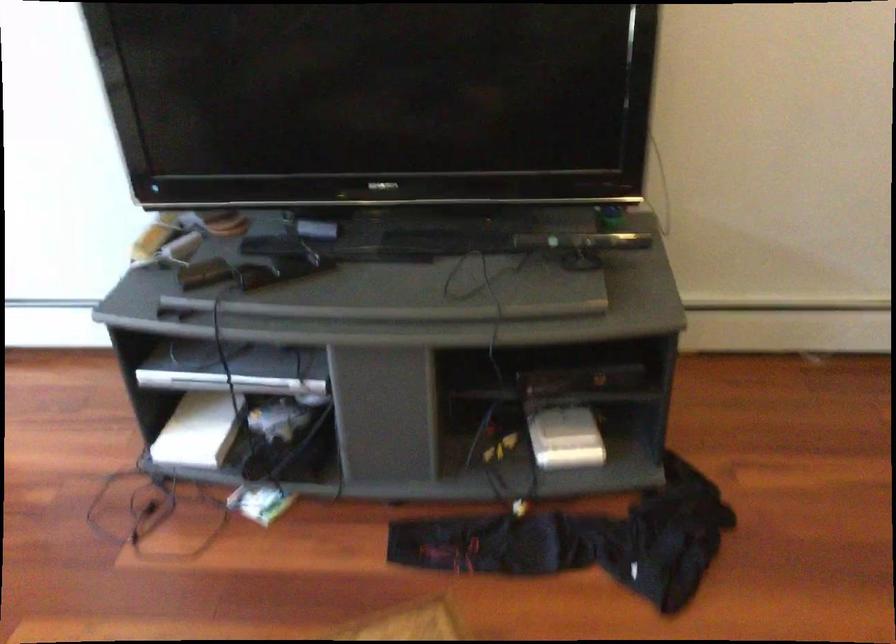
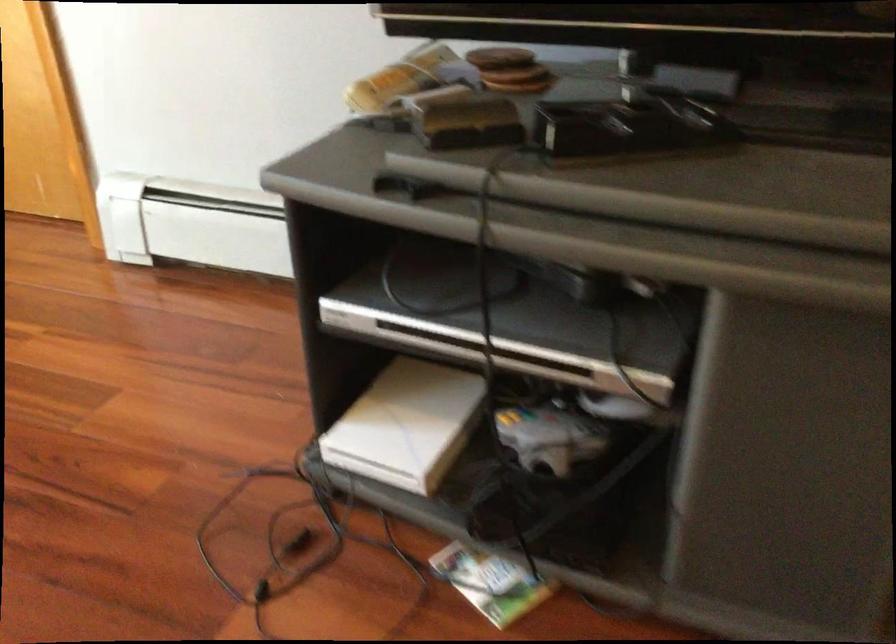
Question: The camera is either moving clockwise (left) or counter-clockwise (right) around the object. The first image is from the beginning of the video and the second image is from the end. Is the camera moving left or right when shooting the video?

Choices:
 (A) Left
 (B) Right

Answer: (B)